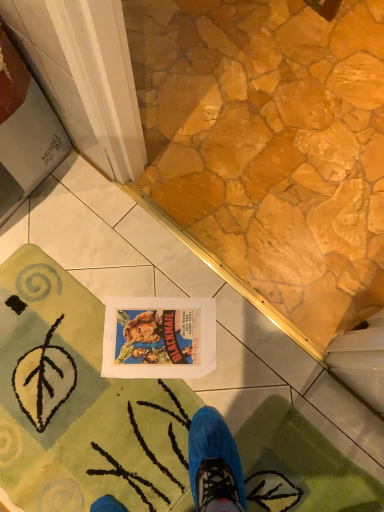
Question: Can you confirm if green plush bath mat at lower left, the 2th bath mat positioned from the right, is taller than green plush bath mat at lower left, the 1th bath mat in the right-to-left sequence?

Choices:
 (A) no
 (B) yes

Answer: (A)

Question: Are green plush bath mat at lower left, which is the first bath mat from left to right, and green plush bath mat at lower left, the 2th bath mat from the left, making contact?

Choices:
 (A) yes
 (B) no

Answer: (B)

Question: Is green plush bath mat at lower left, which is the first bath mat from left to right, bigger than green plush bath mat at lower left, the 1th bath mat in the right-to-left sequence?

Choices:
 (A) no
 (B) yes

Answer: (B)

Question: Is green plush bath mat at lower left, the 2th bath mat positioned from the right, facing towards green plush bath mat at lower left, the 1th bath mat in the right-to-left sequence?

Choices:
 (A) no
 (B) yes

Answer: (A)

Question: Is green plush bath mat at lower left, which is the first bath mat from left to right, oriented away from green plush bath mat at lower left, the 1th bath mat in the right-to-left sequence?

Choices:
 (A) yes
 (B) no

Answer: (B)

Question: Is green plush bath mat at lower left, the 1th bath mat in the right-to-left sequence, surrounded by green plush bath mat at lower left, which is the first bath mat from left to right?

Choices:
 (A) no
 (B) yes

Answer: (A)

Question: Is green plush bath mat at lower left, the 1th bath mat in the right-to-left sequence, at the left side of green plush bath mat at lower left, which is the first bath mat from left to right?

Choices:
 (A) no
 (B) yes

Answer: (A)

Question: Is green plush bath mat at lower left, the 1th bath mat in the right-to-left sequence, smaller than green plush bath mat at lower left, which is the first bath mat from left to right?

Choices:
 (A) no
 (B) yes

Answer: (B)

Question: Is green plush bath mat at lower left, the 1th bath mat in the right-to-left sequence, far away from green plush bath mat at lower left, which is the first bath mat from left to right?

Choices:
 (A) no
 (B) yes

Answer: (A)

Question: Is green plush bath mat at lower left, the 1th bath mat in the right-to-left sequence, shorter than green plush bath mat at lower left, the 2th bath mat positioned from the right?

Choices:
 (A) yes
 (B) no

Answer: (B)

Question: From a real-world perspective, is green plush bath mat at lower left, the 2th bath mat from the left, positioned under green plush bath mat at lower left, the 2th bath mat positioned from the right, based on gravity?

Choices:
 (A) yes
 (B) no

Answer: (B)

Question: Are green plush bath mat at lower left, the 2th bath mat from the left, and green plush bath mat at lower left, which is the first bath mat from left to right, making contact?

Choices:
 (A) yes
 (B) no

Answer: (B)

Question: Based on their positions, is green plush bath mat at lower left, the 2th bath mat positioned from the right, located to the left or right of green plush bath mat at lower left, the 2th bath mat from the left?

Choices:
 (A) left
 (B) right

Answer: (A)